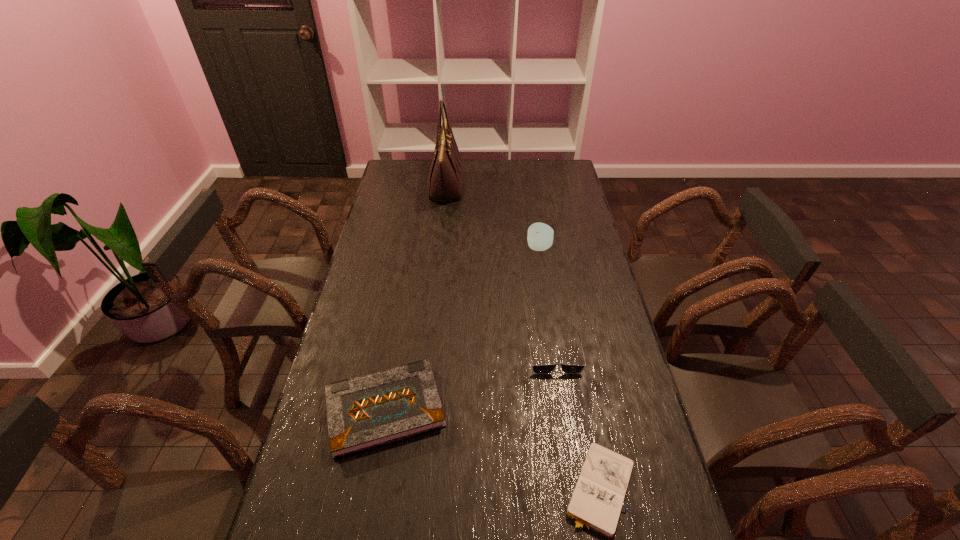
Locate an element on the screen. The image size is (960, 540). vacant space at the far left corner of the desktop is located at coordinates pyautogui.click(x=415, y=160).

Locate an element on the screen. free space between the farthest object and the apple is located at coordinates (492, 217).

This screenshot has height=540, width=960. I want to click on free space between the tallest object and the apple, so click(492, 217).

Locate an element on the screen. The height and width of the screenshot is (540, 960). vacant space that is in between the taller notebook and the sunglasses is located at coordinates (469, 382).

Find the location of `vacant point located between the taller notebook and the sunglasses`. vacant point located between the taller notebook and the sunglasses is located at coordinates (469, 382).

Find the location of a particular element. free space that is in between the fourth shortest object and the sunglasses is located at coordinates (547, 301).

The width and height of the screenshot is (960, 540). What are the coordinates of `free space between the second farthest object and the left notebook` in the screenshot? It's located at (463, 328).

Locate an element on the screen. This screenshot has width=960, height=540. free space between the right notebook and the handbag is located at coordinates (522, 338).

What are the coordinates of `free space between the sunglasses and the fourth shortest object` in the screenshot? It's located at (547, 301).

You are a GUI agent. You are given a task and a screenshot of the screen. Output one action in this format:
    pyautogui.click(x=<x>, y=<y>)
    Task: Click on the free space between the sunglasses and the farthest object
    Image resolution: width=960 pixels, height=540 pixels.
    Given the screenshot: What is the action you would take?
    pyautogui.click(x=500, y=271)